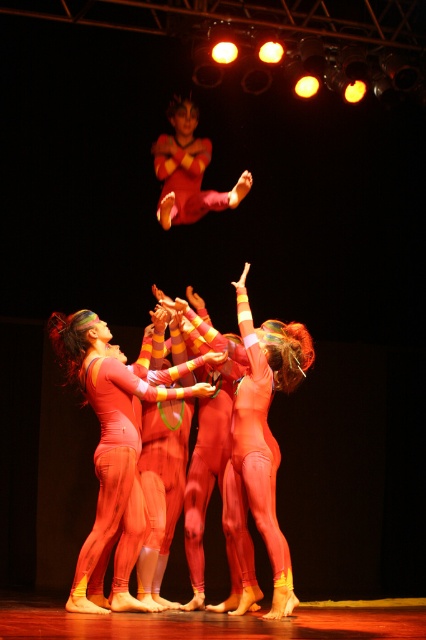
Based on the scene description, can you determine if the matte orange leotard at center is wider than the matte red leotard at upper center?

The matte orange leotard at center might be wider than matte red leotard at upper center according to the description.

In the scene shown: You are a stagehand responsible for ensuring safety during the performance. The minimum safe distance between performers is 2 meters to prevent collisions. Given the distance between the matte orange leotard at center and the matte red leotard at upper center, is the current setup compliant with safety regulations?

The matte orange leotard at center is 2.69 meters from the matte red leotard at upper center. Since 2.69 meters exceeds the minimum required 2 meters, the current setup complies with safety regulations.

You are a stage director observing the acrobatic performance. You need to ensure the performers are positioned correctly. Which performer, the matte orange leotard at center or the matte red leotard at upper center, is higher in the air?

The matte orange leotard at center is higher in the air than the matte red leotard at upper center.